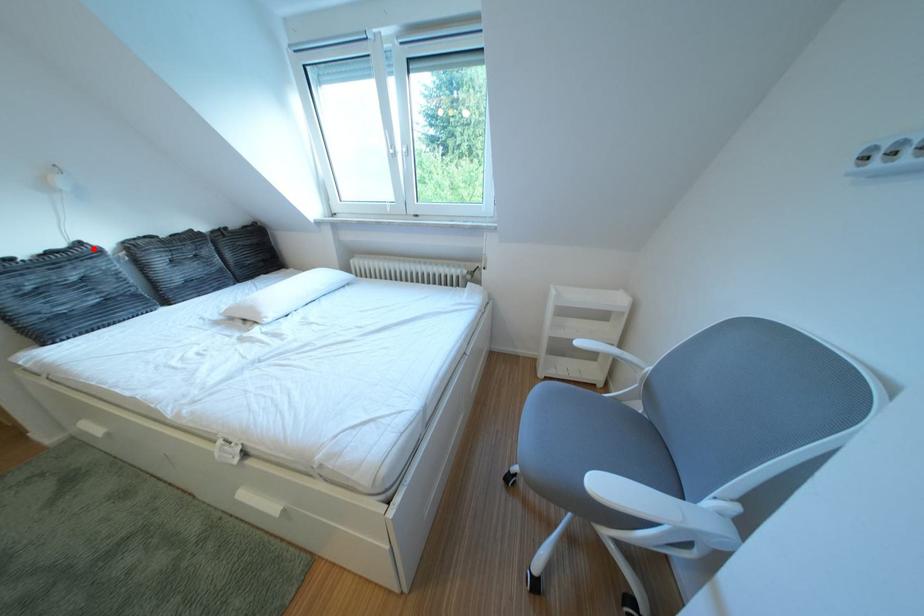
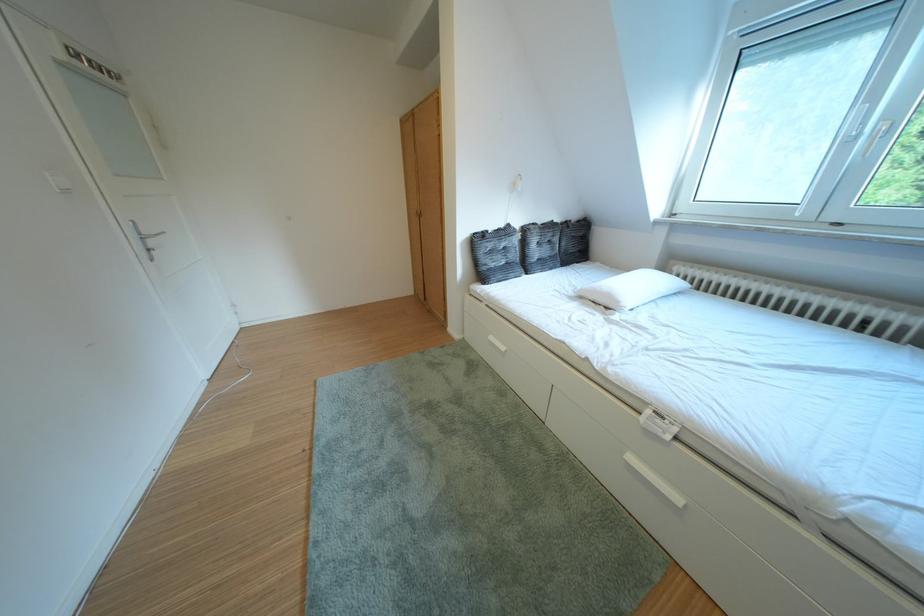
Question: I am providing you with two images of the same scene from different viewpoints. In image1, a red point is highlighted. Considering the same 3D point in image2, which of the following is correct?

Choices:
 (A) It is closer
 (B) It is farther

Answer: (A)